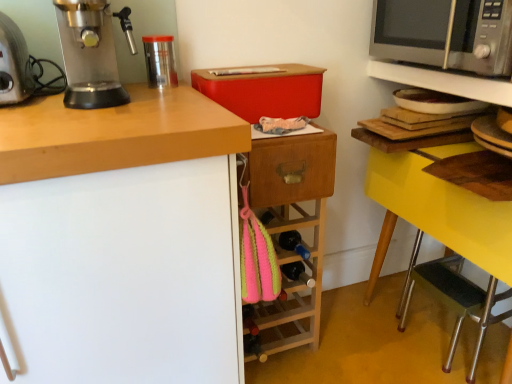
Question: From the image's perspective, does black rubber step stool at lower right appear lower than metallic silver microwave at upper right, the first shelf viewed from the top?

Choices:
 (A) yes
 (B) no

Answer: (A)

Question: Is black rubber step stool at lower right taller than metallic silver microwave at upper right, which appears as the second shelf when ordered from the bottom?

Choices:
 (A) no
 (B) yes

Answer: (B)

Question: From a real-world perspective, is black rubber step stool at lower right positioned under metallic silver microwave at upper right, the first shelf viewed from the top, based on gravity?

Choices:
 (A) no
 (B) yes

Answer: (B)

Question: Does black rubber step stool at lower right lie behind metallic silver microwave at upper right, which appears as the second shelf when ordered from the bottom?

Choices:
 (A) yes
 (B) no

Answer: (A)

Question: Considering the relative sizes of black rubber step stool at lower right and metallic silver microwave at upper right, the first shelf viewed from the top, in the image provided, is black rubber step stool at lower right shorter than metallic silver microwave at upper right, the first shelf viewed from the top,?

Choices:
 (A) yes
 (B) no

Answer: (B)

Question: Does black rubber step stool at lower right lie in front of metallic silver microwave at upper right, the first shelf viewed from the top?

Choices:
 (A) yes
 (B) no

Answer: (B)

Question: From a real-world perspective, does satin silver microwave at upper right stand above metallic silver espresso machine at left?

Choices:
 (A) no
 (B) yes

Answer: (B)

Question: From the image's perspective, is satin silver microwave at upper right above metallic silver espresso machine at left?

Choices:
 (A) yes
 (B) no

Answer: (A)

Question: Considering the relative positions of satin silver microwave at upper right and metallic silver espresso machine at left in the image provided, is satin silver microwave at upper right to the left of metallic silver espresso machine at left from the viewer's perspective?

Choices:
 (A) yes
 (B) no

Answer: (B)

Question: Does satin silver microwave at upper right have a greater width compared to metallic silver espresso machine at left?

Choices:
 (A) no
 (B) yes

Answer: (B)

Question: Is satin silver microwave at upper right looking in the opposite direction of metallic silver espresso machine at left?

Choices:
 (A) no
 (B) yes

Answer: (A)

Question: From the image's perspective, would you say satin silver microwave at upper right is shown under metallic silver espresso machine at left?

Choices:
 (A) yes
 (B) no

Answer: (B)

Question: Is yellow wood table at right, which ranks as the 2th shelf in top-to-bottom order, smaller than metallic silver espresso machine at left?

Choices:
 (A) yes
 (B) no

Answer: (B)